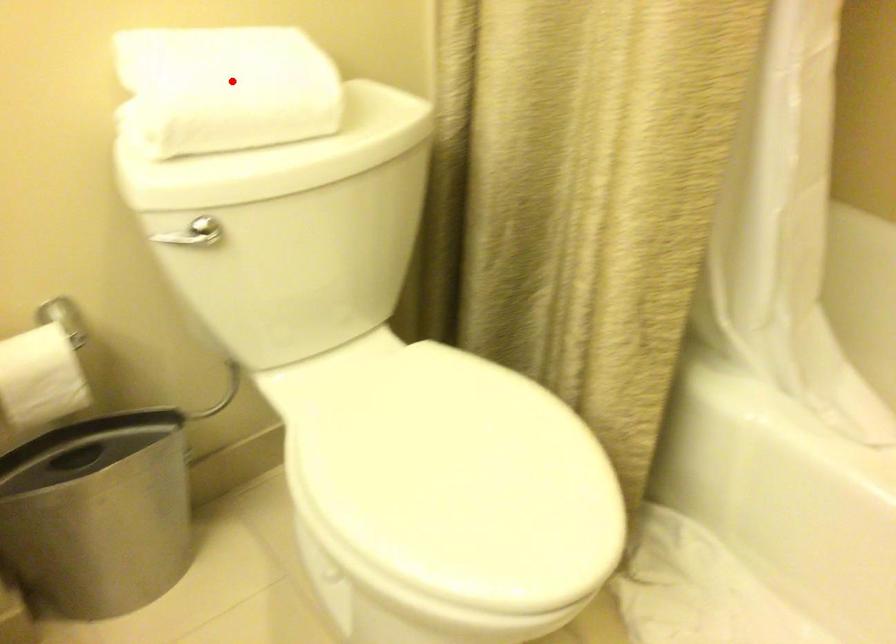
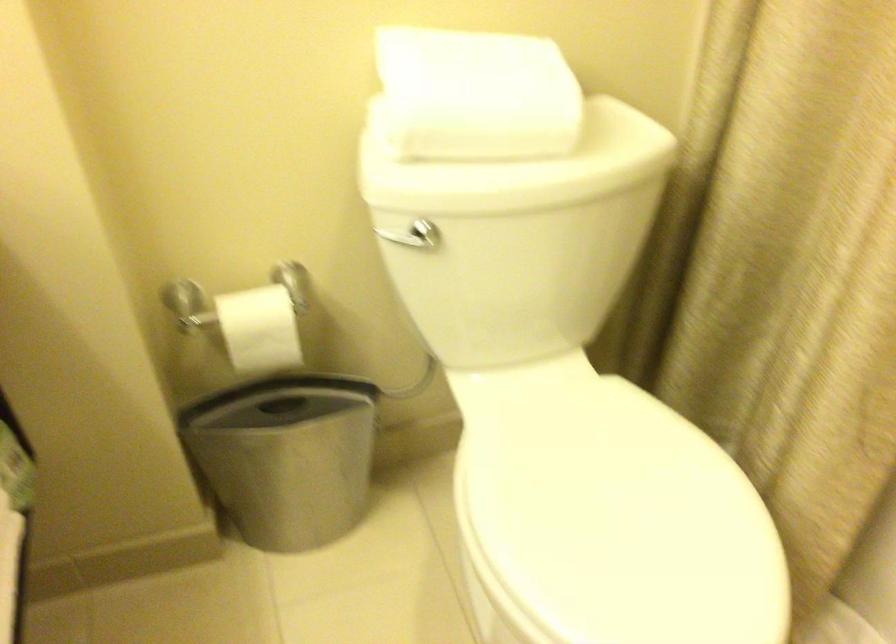
The point at the highlighted location is marked in the first image. Where is the corresponding point in the second image?

(476, 95)